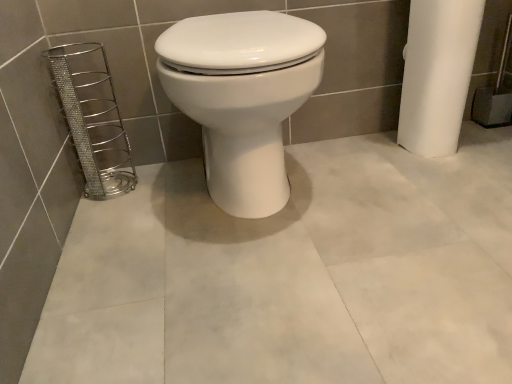
The image size is (512, 384). What are the coordinates of `vacant area to the right of silver metallic wire basket at left` in the screenshot? It's located at (172, 179).